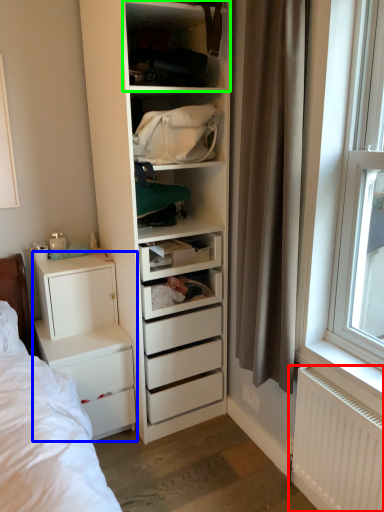
Question: Estimate the real-world distances between objects in this image. Which object is closer to radiator (highlighted by a red box), chest of drawers (highlighted by a blue box) or shelf (highlighted by a green box)?

Choices:
 (A) chest of drawers
 (B) shelf

Answer: (A)